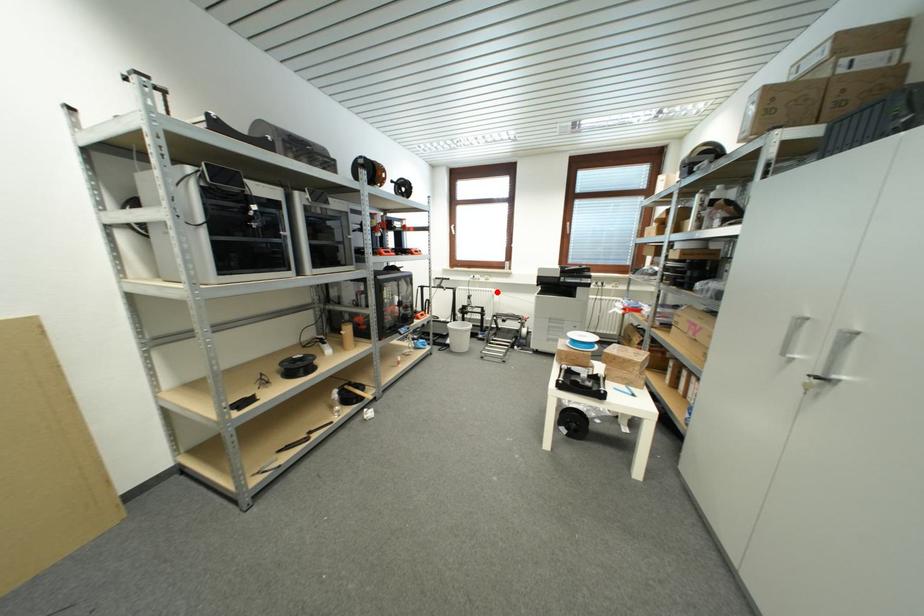
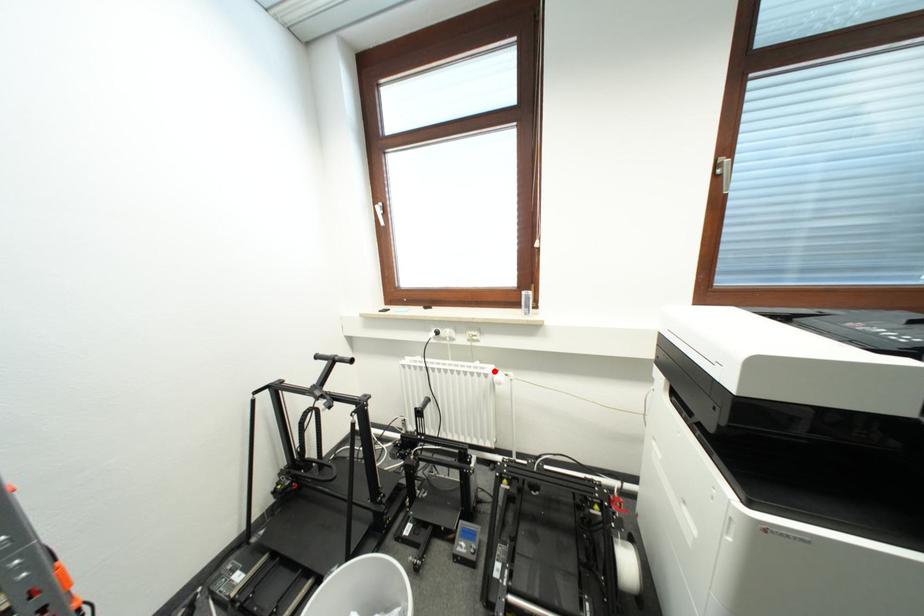
I am providing you with two images of the same scene from different viewpoints. A red point is marked on the first image and another point is marked on the second image. Do the highlighted points in image1 and image2 indicate the same real-world spot?

Yes